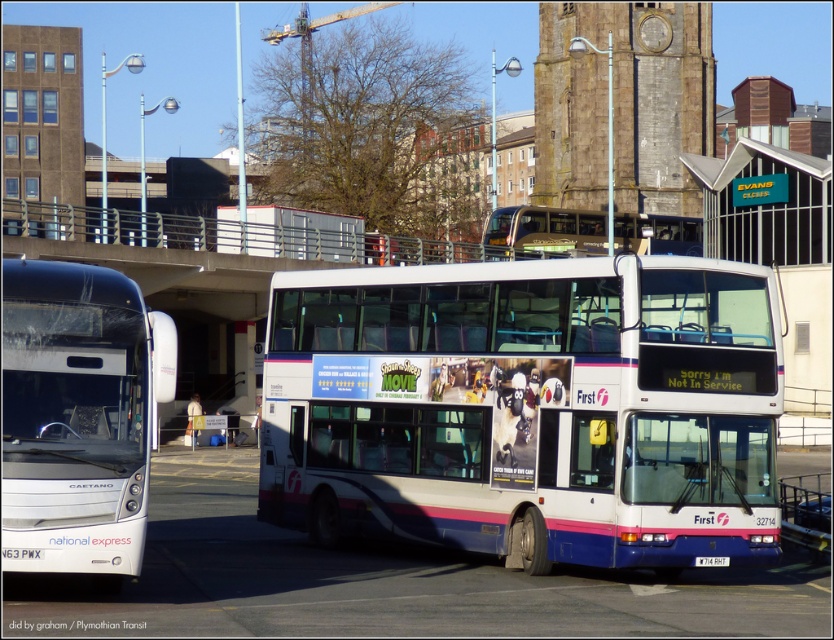
You are a bus driver who needs to park your bus in a garage that has a height restriction of 3 meters. You see the white plastic bus at center and the white matte bus at left. Which bus can safely enter the garage without exceeding the height limit?

The white plastic bus at center has a lesser height compared to the white matte bus at left. Since the garage has a 3 meter height restriction, the white plastic bus at center is shorter and can safely enter without exceeding the limit, while the white matte bus at left may be too tall.

You are a passenger waiting at the bus stop and see the white matte bus at left and the gold metallic bus at center. Which bus should you approach if you want to board the one that is closer to you?

You should approach the white matte bus at left because it is closer to the viewer than the gold metallic bus at center.